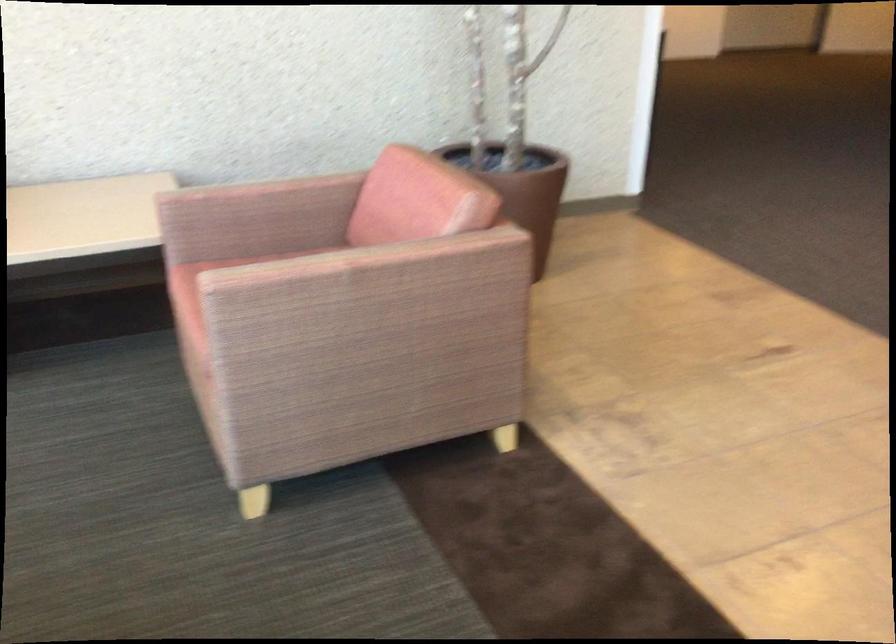
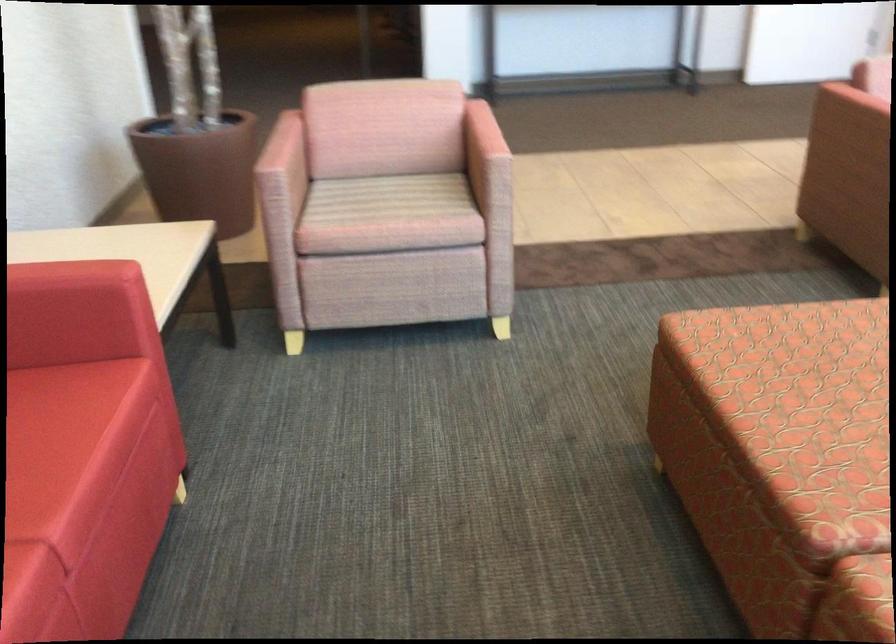
The point at (162, 207) is marked in the first image. Where is the corresponding point in the second image?

(280, 176)